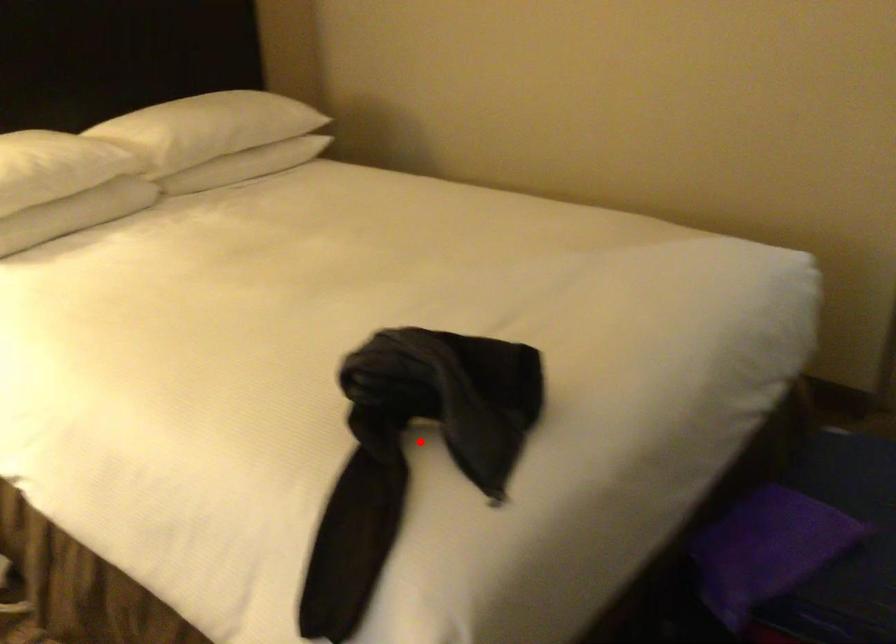
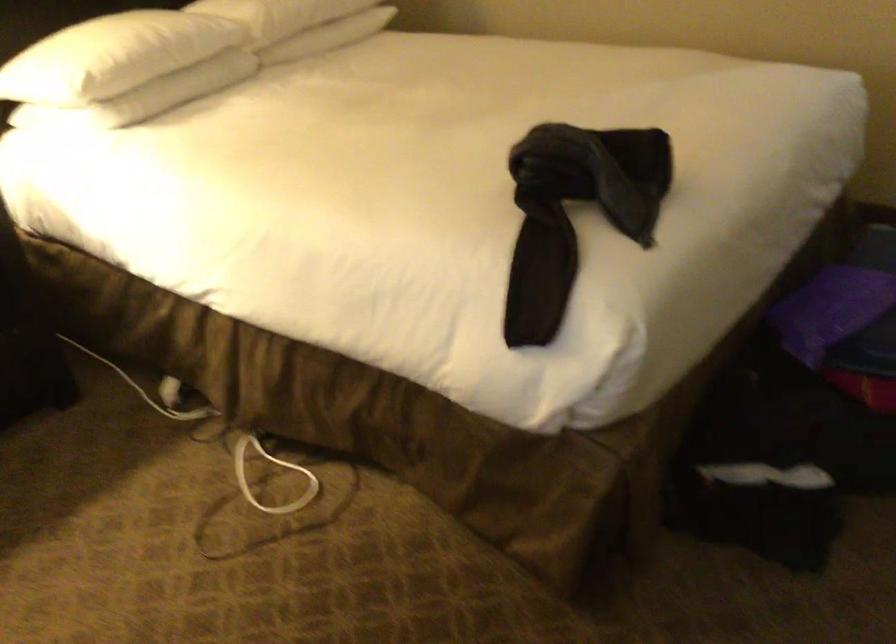
The point at the highlighted location is marked in the first image. Where is the corresponding point in the second image?

(574, 212)